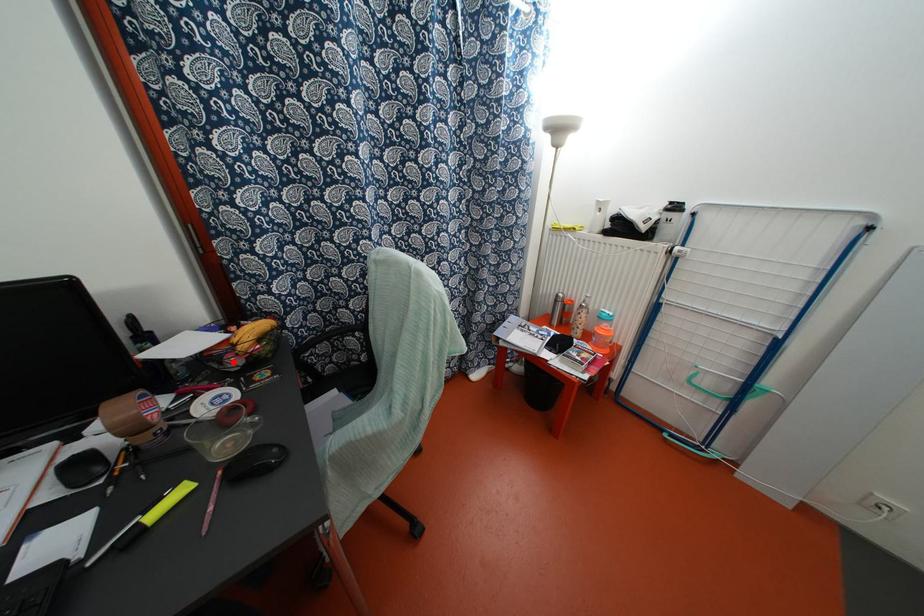
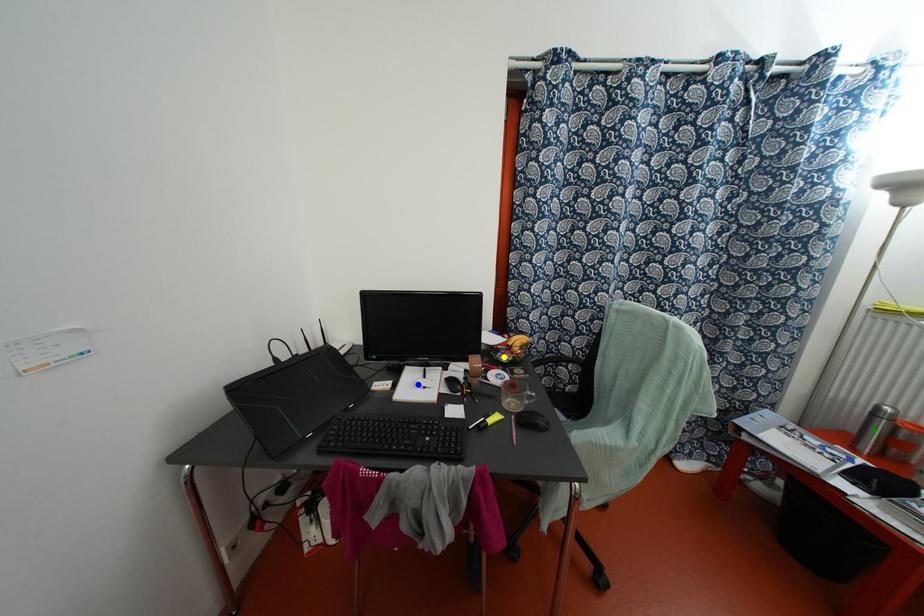
Question: I am providing you with two images of the same scene from different viewpoints. A red point is marked on the first image. You are given multiple points on the second image. Which mark in image 2 goes with the point in image 1?

Choices:
 (A) yellow point
 (B) blue point
 (C) green point

Answer: (A)